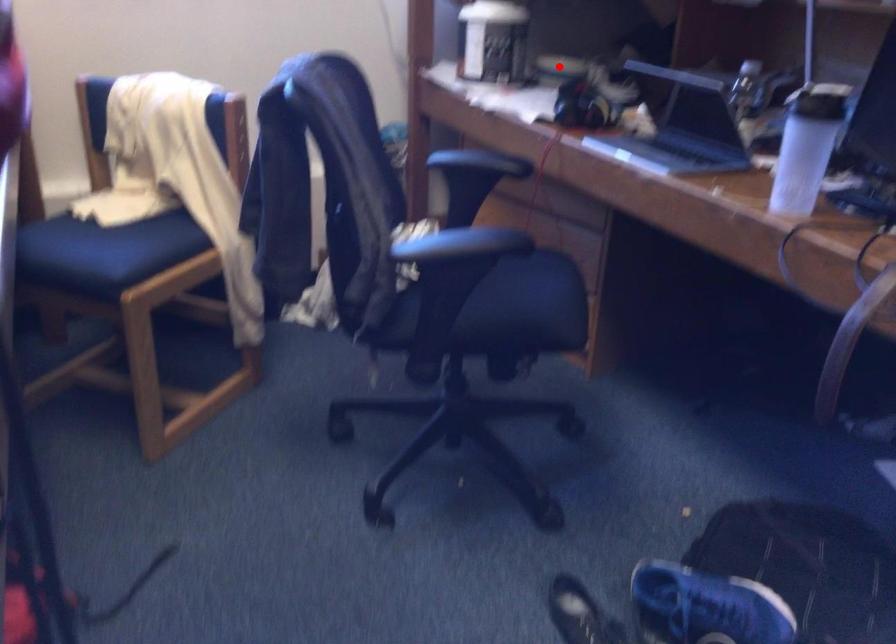
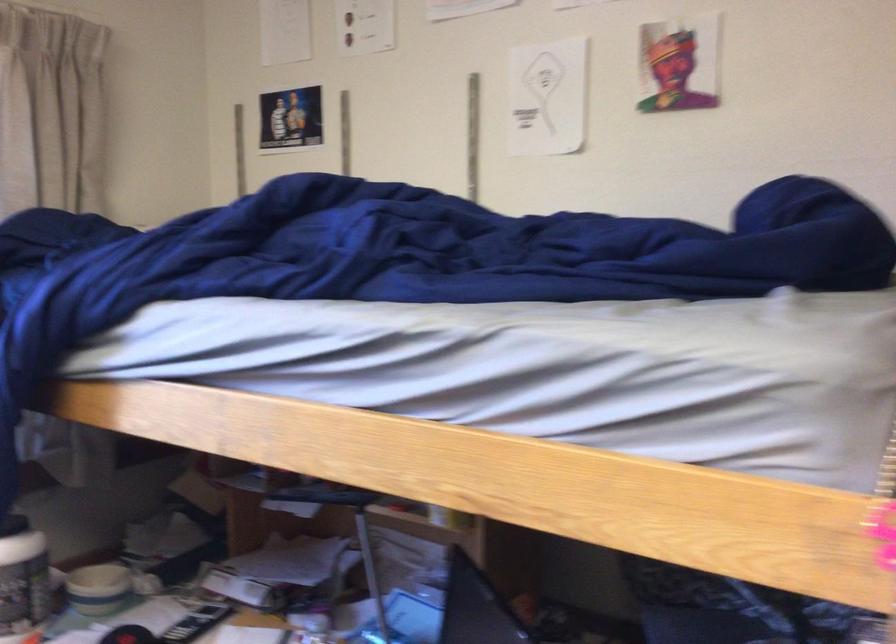
Question: I am providing you with two images of the same scene from different viewpoints. A red point is shown in image1. For the corresponding object point in image2, is it positioned nearer or farther from the camera?

Choices:
 (A) Nearer
 (B) Farther

Answer: (A)